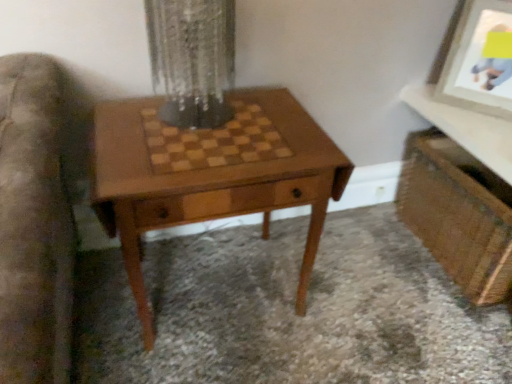
Where is `vacant region above wooden chess table at center (from a real-world perspective)`? The height and width of the screenshot is (384, 512). vacant region above wooden chess table at center (from a real-world perspective) is located at coordinates coord(215,134).